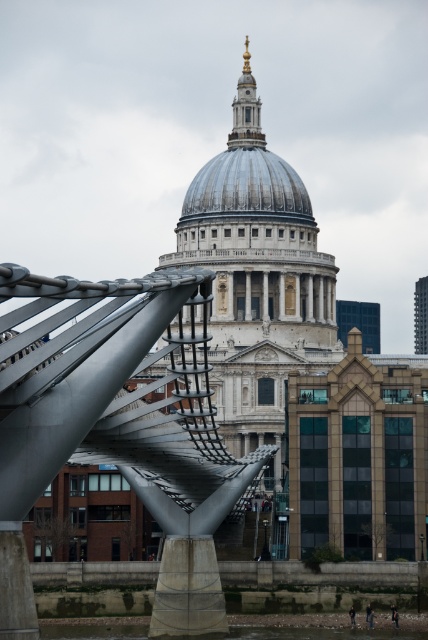
Question: Is metallic gray bridge at center to the left of shiny silver dome at center from the viewer's perspective?

Choices:
 (A) yes
 (B) no

Answer: (A)

Question: Which point is closer to the camera taking this photo?

Choices:
 (A) (168, 596)
 (B) (308, 216)

Answer: (A)

Question: From the image, what is the correct spatial relationship of metallic gray bridge at center in relation to shiny silver dome at center?

Choices:
 (A) right
 (B) left

Answer: (B)

Question: Can you confirm if metallic gray bridge at center is positioned below shiny silver dome at center?

Choices:
 (A) no
 (B) yes

Answer: (B)

Question: Which point is farther to the camera?

Choices:
 (A) metallic gray bridge at center
 (B) shiny silver dome at center

Answer: (B)